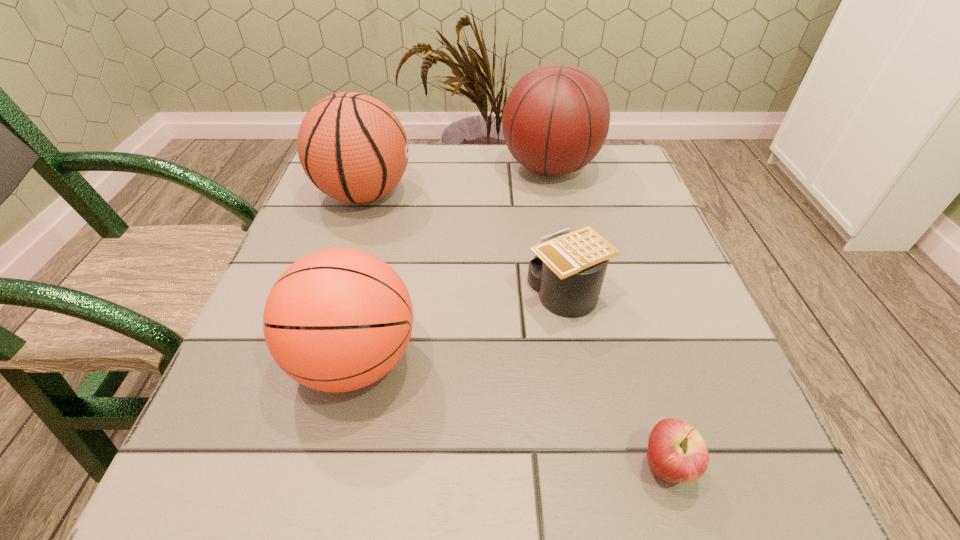
This screenshot has width=960, height=540. I want to click on the second closest basketball to the nearest basketball, so click(556, 119).

You are a GUI agent. You are given a task and a screenshot of the screen. Output one action in this format:
    pyautogui.click(x=<x>, y=<y>)
    Task: Click on the vacant point that satisfies the following two spatial constraints: 1. on the back side of the rightmost basketball; 2. on the left side of the nearest basketball
    The width and height of the screenshot is (960, 540).
    Given the screenshot: What is the action you would take?
    point(401,168)